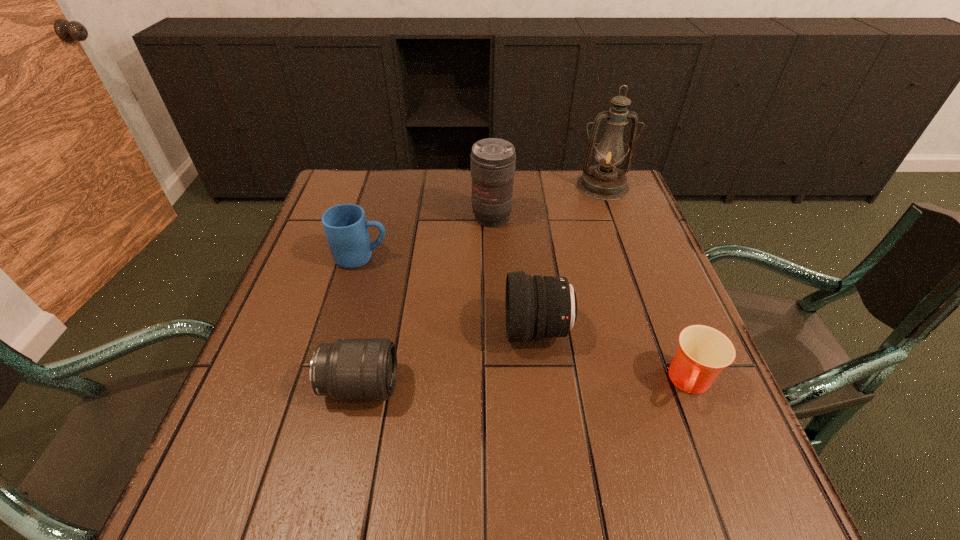
The width and height of the screenshot is (960, 540). What are the coordinates of `free spot located on the side of the farthest telephoto lens where the control switches are located` in the screenshot? It's located at (494, 296).

Image resolution: width=960 pixels, height=540 pixels. I want to click on free space located at the front element of the second tallest telephoto lens, so click(362, 330).

Locate an element on the screen. free spot located at the front element of the second tallest telephoto lens is located at coordinates (477, 330).

Identify the location of blank space located 0.300m at the front element of the second tallest telephoto lens. (362, 330).

The image size is (960, 540). I want to click on vacant space located 0.320m on the side of the fourth nearest object with the handle, so click(521, 258).

This screenshot has height=540, width=960. In order to click on vacant point located 0.210m on the surface of the shortest telephoto lens in this screenshot , I will do `click(510, 386)`.

Identify the location of vacant space situated 0.140m on the back of the cup. (660, 305).

Where is `oil lamp at the far edge`? The image size is (960, 540). oil lamp at the far edge is located at coordinates (604, 182).

I want to click on telephoto lens positioned at the far edge, so click(x=492, y=160).

Find the location of `mug that is at the left edge`. mug that is at the left edge is located at coordinates (346, 229).